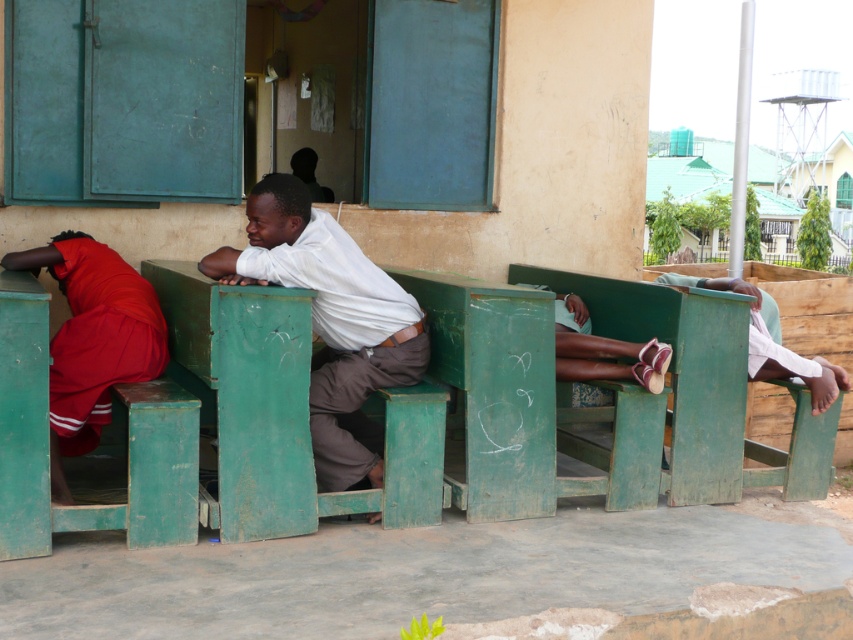
You are a photographer trying to capture a portrait of the two people wearing white matte shirt at center and matte white shirt at center. Since both are wearing similar clothing, how can you distinguish them in the photo based on their height?

The white matte shirt at center is much taller than the matte white shirt at center, so you can distinguish them by capturing the height difference between the two individuals wearing those shirts.